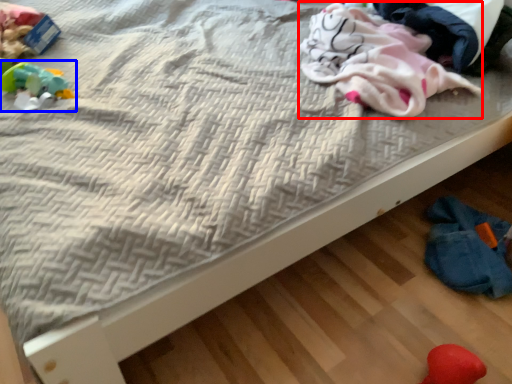
Question: Which object is closer to the camera taking this photo, material (highlighted by a red box) or toy (highlighted by a blue box)?

Choices:
 (A) material
 (B) toy

Answer: (A)